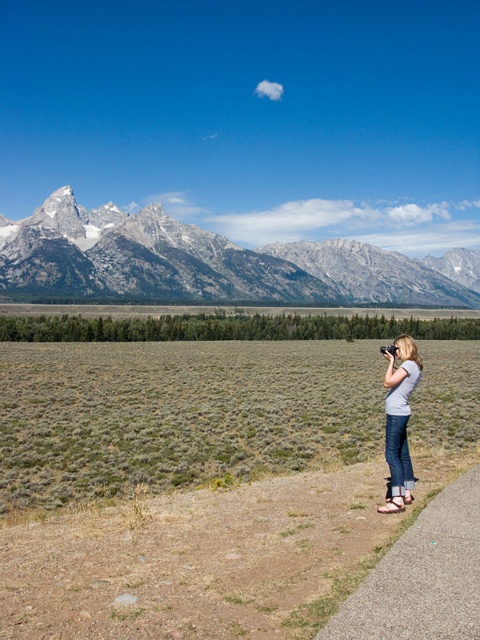
Question: Is white rocky mountain range at upper left to the left of gray cotton shirt at right from the viewer's perspective?

Choices:
 (A) yes
 (B) no

Answer: (B)

Question: Which of the following is the closest to the observer?

Choices:
 (A) (393, 353)
 (B) (111, 252)

Answer: (A)

Question: Where is white rocky mountain range at upper left located in relation to gray cotton shirt at right in the image?

Choices:
 (A) below
 (B) above

Answer: (B)

Question: Can you confirm if white rocky mountain range at upper left is thinner than gray cotton shirt at right?

Choices:
 (A) no
 (B) yes

Answer: (A)

Question: Which of the following is the closest to the observer?

Choices:
 (A) (260, 248)
 (B) (391, 435)

Answer: (B)